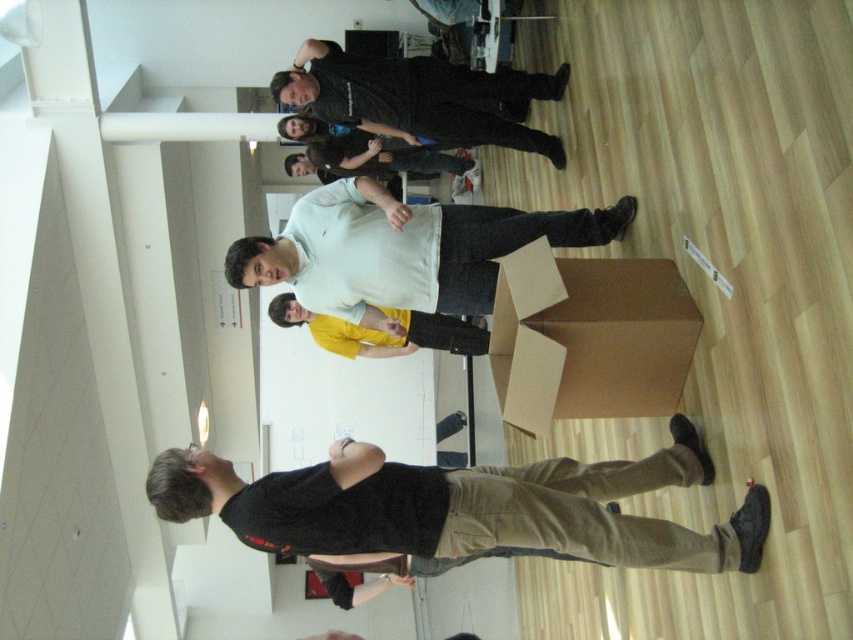
You are standing in the open area near the staircase and want to hand a document to both the black cotton shirt at lower left and the white matte shirt at center. Which person should you approach first to ensure you can reach both without moving far from your current position?

You should approach the white matte shirt at center first because the black cotton shirt at lower left is positioned to the right of the white matte shirt at center, so standing near the center allows you to reach both with minimal movement.

You are standing in the open space and want to move from the point at the center person to the staircase in the background. There are two points marked in the scene, point A at coordinates point (x=428, y=477) and point B at coordinates point (x=503, y=208). Which point should you avoid stepping on if you want to reach the staircase without obstruction?

You should avoid stepping on point B at coordinates point (x=503, y=208) because point A at coordinates point (x=428, y=477) is in front of it, meaning point B is further back and closer to the staircase. Stepping on point B might block your path to the staircase.